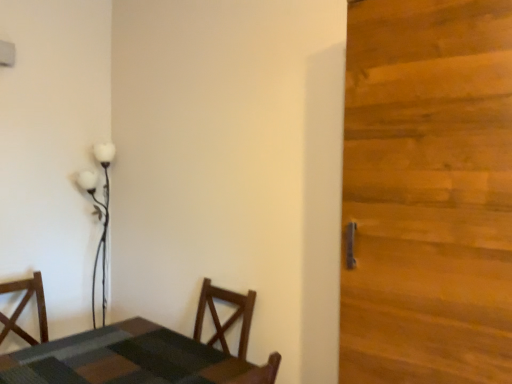
Question: Is wooden door at right behind white glossy floor lamp at upper left?

Choices:
 (A) no
 (B) yes

Answer: (A)

Question: From a real-world perspective, is wooden door at right physically below white glossy floor lamp at upper left?

Choices:
 (A) yes
 (B) no

Answer: (B)

Question: Can you confirm if wooden door at right is smaller than white glossy floor lamp at upper left?

Choices:
 (A) yes
 (B) no

Answer: (B)

Question: From the image's perspective, is wooden door at right on white glossy floor lamp at upper left?

Choices:
 (A) no
 (B) yes

Answer: (B)

Question: Does wooden door at right appear on the right side of white glossy floor lamp at upper left?

Choices:
 (A) yes
 (B) no

Answer: (A)

Question: Is wooden door at right far from white glossy floor lamp at upper left?

Choices:
 (A) yes
 (B) no

Answer: (A)

Question: From a real-world perspective, is textured wood table at lower left positioned under white glossy floor lamp at upper left based on gravity?

Choices:
 (A) no
 (B) yes

Answer: (B)

Question: Is textured wood table at lower left outside white glossy floor lamp at upper left?

Choices:
 (A) no
 (B) yes

Answer: (B)

Question: Is textured wood table at lower left beside white glossy floor lamp at upper left?

Choices:
 (A) no
 (B) yes

Answer: (A)

Question: From the image's perspective, is textured wood table at lower left beneath white glossy floor lamp at upper left?

Choices:
 (A) yes
 (B) no

Answer: (A)

Question: Is textured wood table at lower left oriented away from white glossy floor lamp at upper left?

Choices:
 (A) yes
 (B) no

Answer: (B)

Question: Would you say white glossy floor lamp at upper left is part of textured wood table at lower left's contents?

Choices:
 (A) no
 (B) yes

Answer: (A)

Question: Is wooden door at right closer to camera compared to textured wood table at lower left?

Choices:
 (A) yes
 (B) no

Answer: (A)